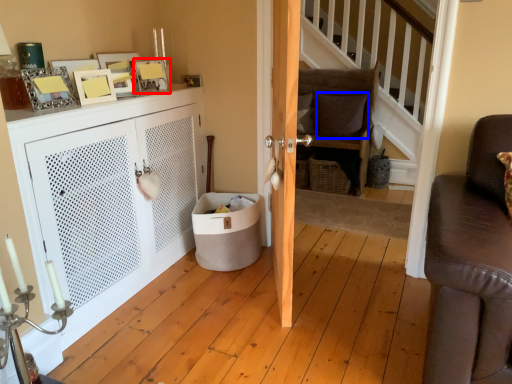
Question: Which object appears closest to the camera in this image, picture frame (highlighted by a red box) or pillow (highlighted by a blue box)?

Choices:
 (A) picture frame
 (B) pillow

Answer: (A)